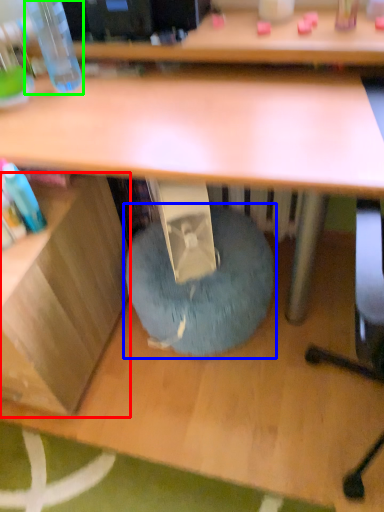
Question: Estimate the real-world distances between objects in this image. Which object is farther from shelf (highlighted by a red box), bean bag chair (highlighted by a blue box) or bottle (highlighted by a green box)?

Choices:
 (A) bean bag chair
 (B) bottle

Answer: (B)